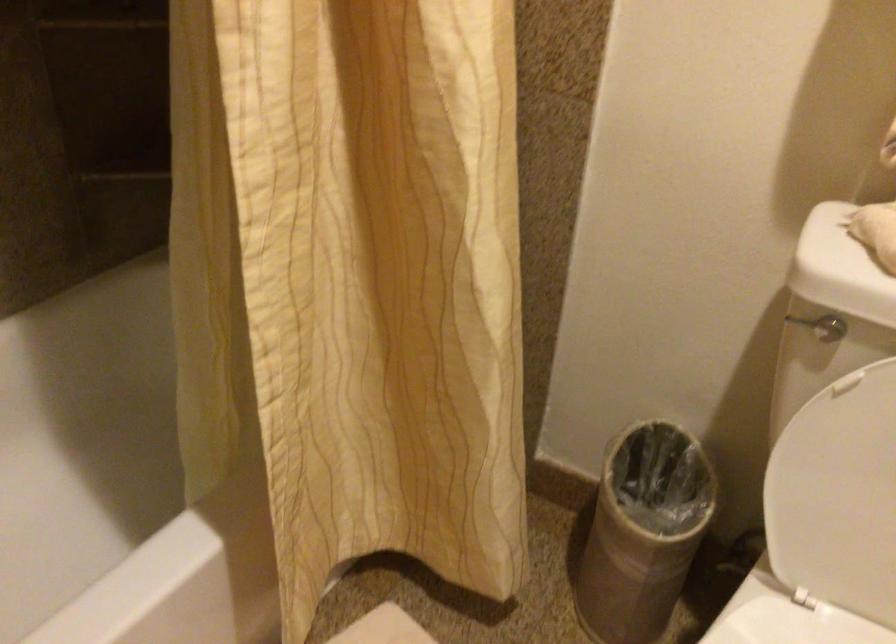
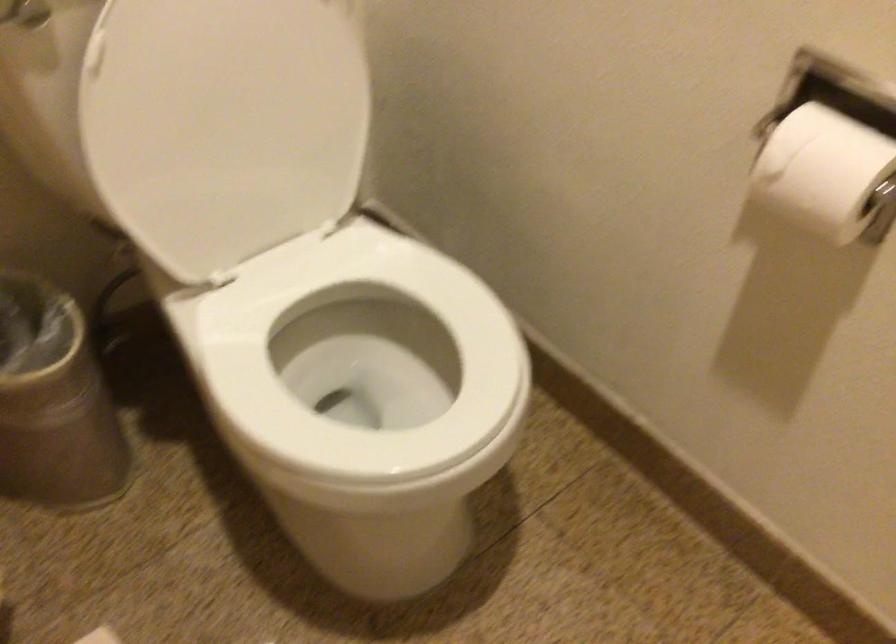
The point at (625, 550) is marked in the first image. Where is the corresponding point in the second image?

(54, 402)